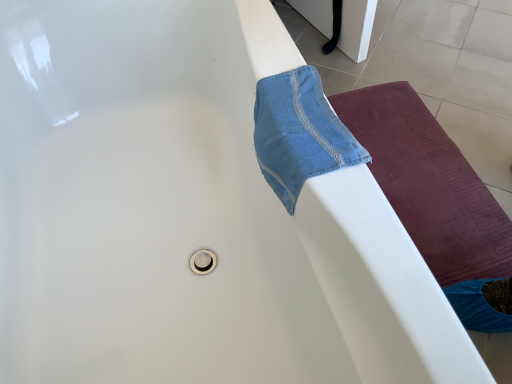
Question: Is blue cotton towel at upper right positioned far away from maroon textured yoga mat at right?

Choices:
 (A) no
 (B) yes

Answer: (A)

Question: Is blue cotton towel at upper right facing away from maroon textured yoga mat at right?

Choices:
 (A) no
 (B) yes

Answer: (A)

Question: Is blue cotton towel at upper right at the left side of maroon textured yoga mat at right?

Choices:
 (A) yes
 (B) no

Answer: (A)

Question: Is the position of blue cotton towel at upper right more distant than that of maroon textured yoga mat at right?

Choices:
 (A) no
 (B) yes

Answer: (A)

Question: Is blue cotton towel at upper right thinner than maroon textured yoga mat at right?

Choices:
 (A) yes
 (B) no

Answer: (A)

Question: From the image's perspective, is blue cotton towel at upper right on top of maroon textured yoga mat at right?

Choices:
 (A) yes
 (B) no

Answer: (A)

Question: Considering the relative sizes of maroon textured yoga mat at right and blue cotton towel at upper right in the image provided, is maroon textured yoga mat at right thinner than blue cotton towel at upper right?

Choices:
 (A) yes
 (B) no

Answer: (B)

Question: From a real-world perspective, is maroon textured yoga mat at right below blue cotton towel at upper right?

Choices:
 (A) yes
 (B) no

Answer: (A)

Question: From the image's perspective, is maroon textured yoga mat at right under blue cotton towel at upper right?

Choices:
 (A) no
 (B) yes

Answer: (B)

Question: Is blue cotton towel at upper right at the back of maroon textured yoga mat at right?

Choices:
 (A) no
 (B) yes

Answer: (A)

Question: Could you tell me if maroon textured yoga mat at right is facing blue cotton towel at upper right?

Choices:
 (A) yes
 (B) no

Answer: (B)

Question: Considering the relative positions of maroon textured yoga mat at right and blue cotton towel at upper right in the image provided, is maroon textured yoga mat at right to the left of blue cotton towel at upper right from the viewer's perspective?

Choices:
 (A) no
 (B) yes

Answer: (A)

Question: From their relative heights in the image, would you say blue cotton towel at upper right is taller or shorter than maroon textured yoga mat at right?

Choices:
 (A) tall
 (B) short

Answer: (B)